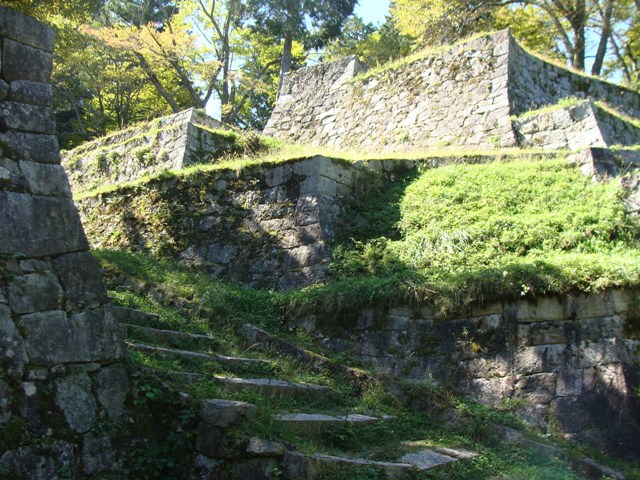
Locate an element on the screen. top right wall is located at coordinates (166, 144).